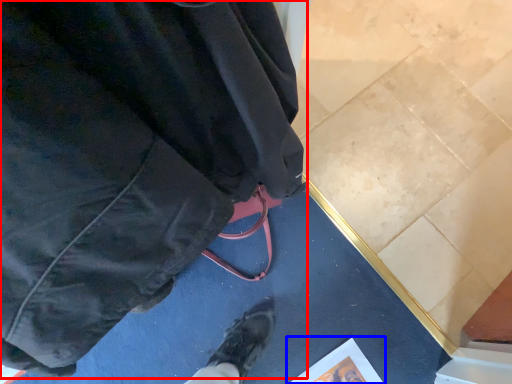
Question: Which object is closer to the camera taking this photo, jacket (highlighted by a red box) or paperback book (highlighted by a blue box)?

Choices:
 (A) jacket
 (B) paperback book

Answer: (A)